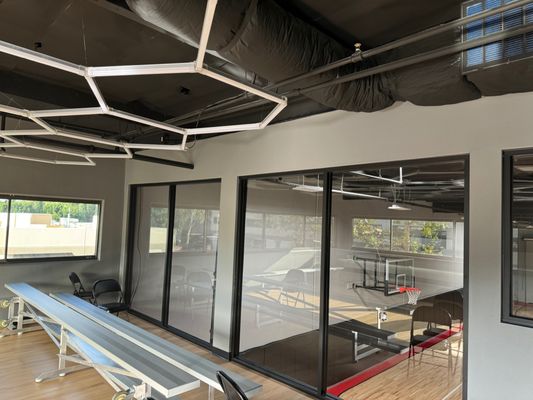
The width and height of the screenshot is (533, 400). Identify the location of square vent. (423, 88).